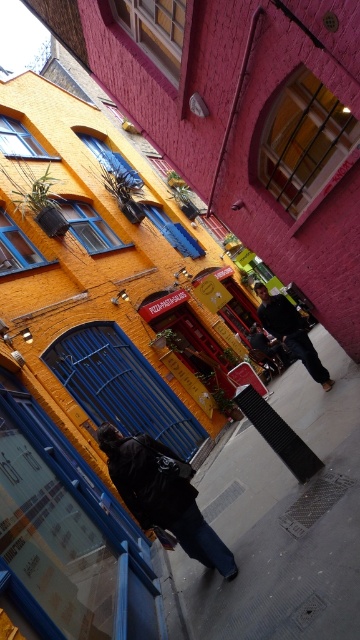
Is concrete sidewalk at center to the right of dark blue jacket at lower left from the viewer's perspective?

Indeed, concrete sidewalk at center is positioned on the right side of dark blue jacket at lower left.

Is point (339, 560) positioned behind point (185, 532)?

No.

Measure the distance between concrete sidewalk at center and camera.

A distance of 3.76 meters exists between concrete sidewalk at center and camera.

The image size is (360, 640). I want to click on concrete sidewalk at center, so 284,518.

Can you confirm if dark blue jacket at lower left is taller than dark blue jeans at center?

Indeed, dark blue jacket at lower left has a greater height compared to dark blue jeans at center.

Measure the distance between dark blue jacket at lower left and dark blue jeans at center.

3.77 meters

Is point (200, 515) farther from camera compared to point (309, 358)?

No, it is in front of (309, 358).

Image resolution: width=360 pixels, height=640 pixels. Identify the location of dark blue jacket at lower left. (163, 493).

Is concrete sidewalk at center to the left of dark blue jeans at center from the viewer's perspective?

Yes, concrete sidewalk at center is to the left of dark blue jeans at center.

Between concrete sidewalk at center and dark blue jeans at center, which one appears on the right side from the viewer's perspective?

Positioned to the right is dark blue jeans at center.

This screenshot has height=640, width=360. What are the coordinates of `concrete sidewalk at center` in the screenshot? It's located at (284, 518).

Find the location of a particular element. concrete sidewalk at center is located at coordinates (284, 518).